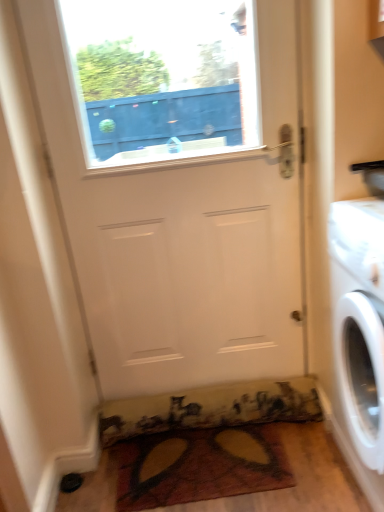
Question: Is multicolored fabric doormat at lower center, which is the second doormat from top to bottom, taller than white matte door at center?

Choices:
 (A) no
 (B) yes

Answer: (A)

Question: Is multicolored fabric doormat at lower center, which appears as the first doormat when ordered from the bottom, located outside white matte door at center?

Choices:
 (A) no
 (B) yes

Answer: (B)

Question: From the image's perspective, does multicolored fabric doormat at lower center, which appears as the first doormat when ordered from the bottom, appear lower than white matte door at center?

Choices:
 (A) yes
 (B) no

Answer: (A)

Question: Is multicolored fabric doormat at lower center, which appears as the first doormat when ordered from the bottom, oriented away from white matte door at center?

Choices:
 (A) yes
 (B) no

Answer: (B)

Question: Can you confirm if multicolored fabric doormat at lower center, which is the second doormat from top to bottom, is positioned to the left of white matte door at center?

Choices:
 (A) yes
 (B) no

Answer: (B)

Question: Are multicolored fabric doormat at lower center, which is the second doormat from top to bottom, and white matte door at center located far from each other?

Choices:
 (A) no
 (B) yes

Answer: (A)

Question: From a real-world perspective, is white glossy washing machine at right below white matte door at center?

Choices:
 (A) no
 (B) yes

Answer: (B)

Question: Is white glossy washing machine at right at the right side of white matte door at center?

Choices:
 (A) yes
 (B) no

Answer: (A)

Question: Is white glossy washing machine at right bigger than white matte door at center?

Choices:
 (A) yes
 (B) no

Answer: (A)

Question: Could you tell me if white glossy washing machine at right is turned towards white matte door at center?

Choices:
 (A) no
 (B) yes

Answer: (A)

Question: Considering the relative sizes of white glossy washing machine at right and white matte door at center in the image provided, is white glossy washing machine at right thinner than white matte door at center?

Choices:
 (A) no
 (B) yes

Answer: (A)

Question: Does white glossy washing machine at right appear on the left side of white matte door at center?

Choices:
 (A) no
 (B) yes

Answer: (A)

Question: From the image's perspective, is multicolored fabric doormat at lower center, the second doormat in the bottom-to-top sequence, below multicolored fabric doormat at lower center, which appears as the first doormat when ordered from the bottom?

Choices:
 (A) no
 (B) yes

Answer: (A)